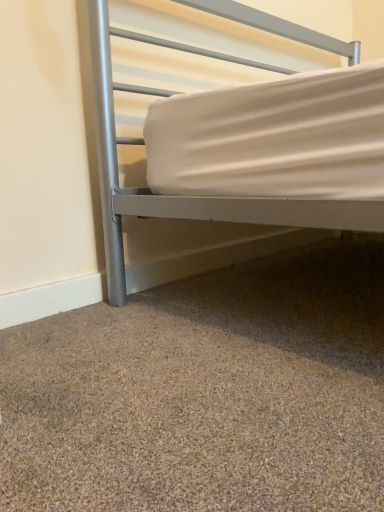
What are the coordinates of `silver metallic bed at upper center` in the screenshot? It's located at (192, 197).

The width and height of the screenshot is (384, 512). Describe the element at coordinates (192, 197) in the screenshot. I see `silver metallic bed at upper center` at that location.

This screenshot has height=512, width=384. Describe the element at coordinates (205, 393) in the screenshot. I see `brown textured carpet at lower center` at that location.

Where is `brown textured carpet at lower center`? brown textured carpet at lower center is located at coordinates (205, 393).

You are a GUI agent. You are given a task and a screenshot of the screen. Output one action in this format:
    pyautogui.click(x=<x>, y=<y>)
    Task: Click on the silver metallic bed at upper center
    The image size is (384, 512).
    Given the screenshot: What is the action you would take?
    pyautogui.click(x=192, y=197)

Would you say silver metallic bed at upper center is to the left or to the right of brown textured carpet at lower center in the picture?

From the image, it's evident that silver metallic bed at upper center is to the right of brown textured carpet at lower center.

Is silver metallic bed at upper center in front of or behind brown textured carpet at lower center in the image?

silver metallic bed at upper center is positioned farther from the viewer than brown textured carpet at lower center.

Is point (245, 215) closer or farther from the camera than point (271, 339)?

Point (245, 215).

From the image's perspective, is silver metallic bed at upper center below brown textured carpet at lower center?

No.

From the picture: From a real-world perspective, who is located higher, silver metallic bed at upper center or brown textured carpet at lower center?

From a 3D spatial view, silver metallic bed at upper center is above.

Looking at their sizes, would you say silver metallic bed at upper center is wider or thinner than brown textured carpet at lower center?

Clearly, silver metallic bed at upper center has less width compared to brown textured carpet at lower center.

Is silver metallic bed at upper center taller or shorter than brown textured carpet at lower center?

Considering their sizes, silver metallic bed at upper center has more height than brown textured carpet at lower center.

Is silver metallic bed at upper center bigger than brown textured carpet at lower center?

Correct, silver metallic bed at upper center is larger in size than brown textured carpet at lower center.

Is brown textured carpet at lower center inside silver metallic bed at upper center?

No, silver metallic bed at upper center does not contain brown textured carpet at lower center.

Is silver metallic bed at upper center with brown textured carpet at lower center?

No, silver metallic bed at upper center is not touching brown textured carpet at lower center.

Is silver metallic bed at upper center facing away from brown textured carpet at lower center?

That's not correct — silver metallic bed at upper center is not looking away from brown textured carpet at lower center.

What's the angular difference between silver metallic bed at upper center and brown textured carpet at lower center's facing directions?

There is a 91.2-degree angle between the facing directions of silver metallic bed at upper center and brown textured carpet at lower center.

You are a GUI agent. You are given a task and a screenshot of the screen. Output one action in this format:
    pyautogui.click(x=<x>, y=<y>)
    Task: Click on the bed behind the brown textured carpet at lower center
    Image resolution: width=384 pixels, height=512 pixels.
    Given the screenshot: What is the action you would take?
    pyautogui.click(x=192, y=197)

Between brown textured carpet at lower center and silver metallic bed at upper center, which one appears on the right side from the viewer's perspective?

Positioned to the right is silver metallic bed at upper center.

Relative to silver metallic bed at upper center, is brown textured carpet at lower center in front or behind?

Clearly, brown textured carpet at lower center is in front of silver metallic bed at upper center.

Considering the points (286, 362) and (345, 44), which point is in front, point (286, 362) or point (345, 44)?

Positioned in front is point (286, 362).

From the image's perspective, is brown textured carpet at lower center located above silver metallic bed at upper center?

Actually, brown textured carpet at lower center appears below silver metallic bed at upper center in the image.

From a real-world perspective, is brown textured carpet at lower center located beneath silver metallic bed at upper center?

Yes.

Between brown textured carpet at lower center and silver metallic bed at upper center, which one has larger width?

brown textured carpet at lower center.

Is brown textured carpet at lower center taller or shorter than silver metallic bed at upper center?

brown textured carpet at lower center is shorter than silver metallic bed at upper center.

Is brown textured carpet at lower center smaller than silver metallic bed at upper center?

Indeed, brown textured carpet at lower center has a smaller size compared to silver metallic bed at upper center.

Is brown textured carpet at lower center inside the boundaries of silver metallic bed at upper center, or outside?

brown textured carpet at lower center cannot be found inside silver metallic bed at upper center.

Is brown textured carpet at lower center not near silver metallic bed at upper center?

No, brown textured carpet at lower center is not far from silver metallic bed at upper center.

Is brown textured carpet at lower center facing away from silver metallic bed at upper center?

That's not correct — brown textured carpet at lower center is not looking away from silver metallic bed at upper center.

Consider the image. How many degrees apart are the facing directions of brown textured carpet at lower center and silver metallic bed at upper center?

91.2 degrees separate the facing orientations of brown textured carpet at lower center and silver metallic bed at upper center.

This screenshot has height=512, width=384. What are the coordinates of `granite below the silver metallic bed at upper center (from the image's perspective)` in the screenshot? It's located at (205, 393).

The image size is (384, 512). What are the coordinates of `bed located behind the brown textured carpet at lower center` in the screenshot? It's located at (192, 197).

You are a GUI agent. You are given a task and a screenshot of the screen. Output one action in this format:
    pyautogui.click(x=<x>, y=<y>)
    Task: Click on the bed lying above the brown textured carpet at lower center (from the image's perspective)
    
    Given the screenshot: What is the action you would take?
    pyautogui.click(x=192, y=197)